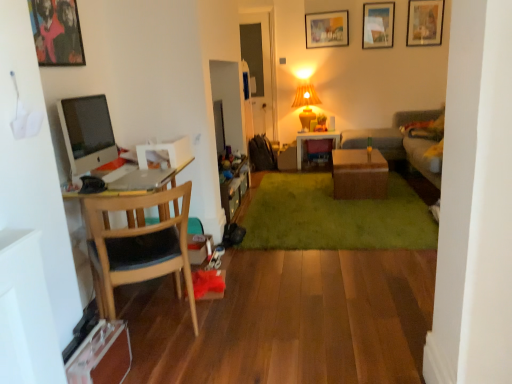
Question: Is wooden chair at left to the right of metallic framed artwork at upper left, the fourth picture frame from the back, from the viewer's perspective?

Choices:
 (A) no
 (B) yes

Answer: (B)

Question: Would you consider wooden chair at left to be distant from metallic framed artwork at upper left, the fourth picture frame positioned from the top?

Choices:
 (A) yes
 (B) no

Answer: (A)

Question: Does wooden chair at left have a lesser width compared to metallic framed artwork at upper left, which is the fourth picture frame in right-to-left order?

Choices:
 (A) yes
 (B) no

Answer: (B)

Question: From a real-world perspective, does wooden chair at left stand above metallic framed artwork at upper left, which is the 1th picture frame from left to right?

Choices:
 (A) no
 (B) yes

Answer: (A)

Question: Can you confirm if wooden chair at left is smaller than metallic framed artwork at upper left, which is the fourth picture frame in right-to-left order?

Choices:
 (A) yes
 (B) no

Answer: (B)

Question: Does wooden chair at left have a greater width compared to metallic framed artwork at upper left, which is the 1th picture frame from left to right?

Choices:
 (A) no
 (B) yes

Answer: (B)

Question: Does silver metallic laptop at left appear on the left side of yellow fabric lampshade at upper center?

Choices:
 (A) yes
 (B) no

Answer: (A)

Question: From a real-world perspective, is silver metallic laptop at left located beneath yellow fabric lampshade at upper center?

Choices:
 (A) yes
 (B) no

Answer: (A)

Question: Is silver metallic laptop at left turned away from yellow fabric lampshade at upper center?

Choices:
 (A) yes
 (B) no

Answer: (B)

Question: From the image's perspective, would you say silver metallic laptop at left is shown under yellow fabric lampshade at upper center?

Choices:
 (A) yes
 (B) no

Answer: (A)

Question: Considering the relative sizes of silver metallic laptop at left and yellow fabric lampshade at upper center in the image provided, is silver metallic laptop at left wider than yellow fabric lampshade at upper center?

Choices:
 (A) yes
 (B) no

Answer: (B)

Question: Can you confirm if silver metallic laptop at left is smaller than yellow fabric lampshade at upper center?

Choices:
 (A) yes
 (B) no

Answer: (A)

Question: Considering the relative positions of wooden picture frame at upper center, arranged as the 1th picture frame when viewed from the back, and matte glass picture frame at upper right, the third picture frame ordered from the bottom, in the image provided, is wooden picture frame at upper center, arranged as the 1th picture frame when viewed from the back, to the left of matte glass picture frame at upper right, the third picture frame ordered from the bottom, from the viewer's perspective?

Choices:
 (A) yes
 (B) no

Answer: (A)